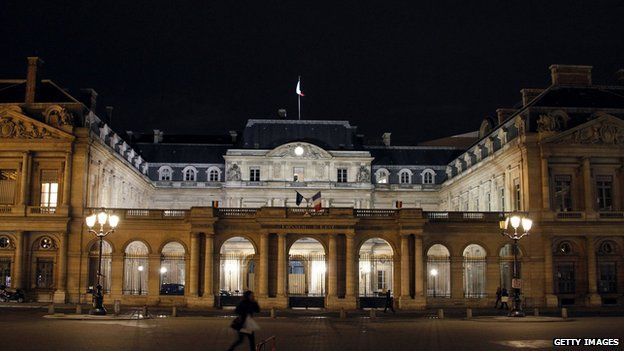
What are the coordinates of `window` in the screenshot? It's located at (168, 171).